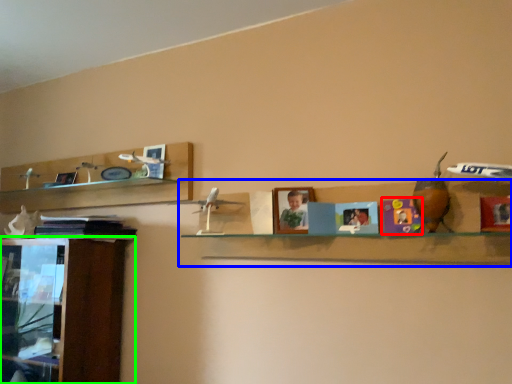
Question: Considering the real-world distances, which object is farthest from toy (highlighted by a red box)? shelf (highlighted by a blue box) or cabinetry (highlighted by a green box)?

Choices:
 (A) shelf
 (B) cabinetry

Answer: (B)